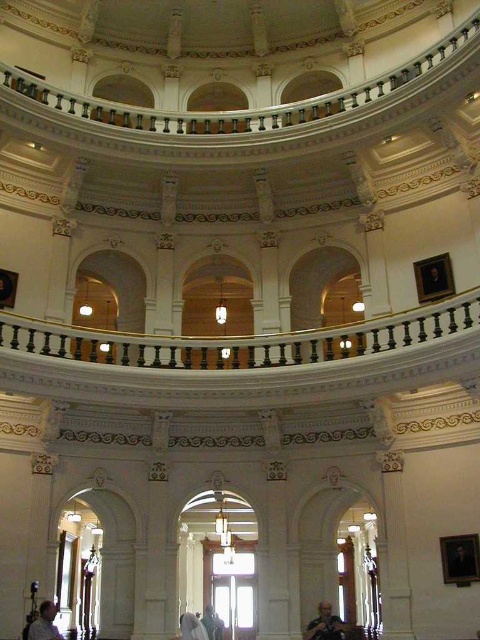
You are standing in the grand rotunda and need to place a new decorative item. You have a gray fabric jacket at lower center and a light brown wooden chair at lower left. Which object is closer to you?

The gray fabric jacket at lower center is closer to you because it is further to the viewer than the light brown wooden chair at lower left.

You are a visitor in this grand building and see both the gray fabric jacket at lower center and the light brown wooden chair at lower left. Which object takes up more space in the image?

The light brown wooden chair at lower left takes up more space in the image because it is larger than the gray fabric jacket at lower center.